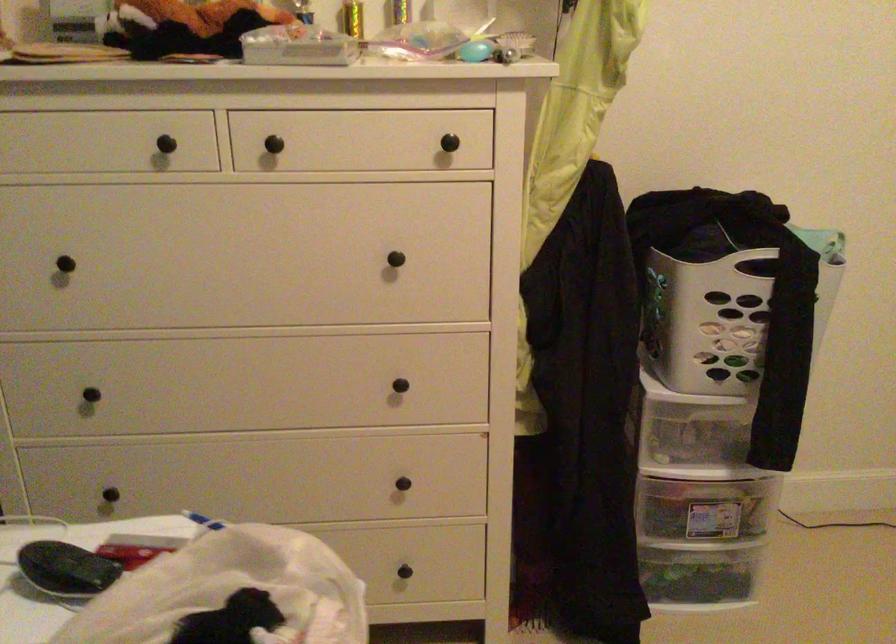
Image resolution: width=896 pixels, height=644 pixels. What are the coordinates of `laundry basket handle` in the screenshot? It's located at (829, 277).